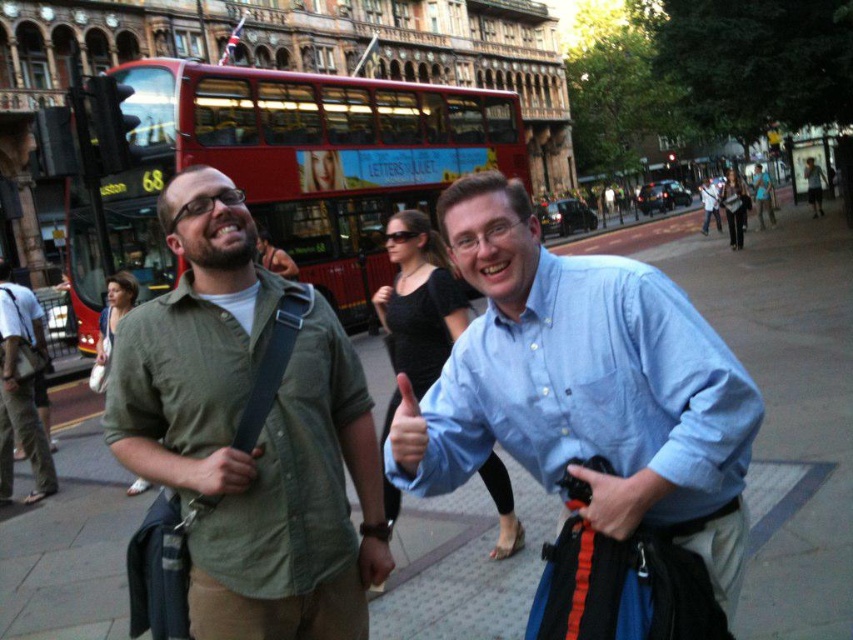
Question: From the image, what is the correct spatial relationship of light blue cotton shirt at center in relation to green cotton shirt at center?

Choices:
 (A) above
 (B) below

Answer: (B)

Question: Can you confirm if red double-decker bus at center is smaller than matte skin at center?

Choices:
 (A) no
 (B) yes

Answer: (A)

Question: Is light blue cotton shirt at center positioned in front of light blue shirt at center?

Choices:
 (A) yes
 (B) no

Answer: (A)

Question: Which of these objects is positioned closest to the matte skin at center?

Choices:
 (A) light blue cotton shirt at center
 (B) smooth skin hand at center

Answer: (B)

Question: Which point is farther from the camera taking this photo?

Choices:
 (A) (376, 531)
 (B) (247, 465)
 (C) (221, 294)

Answer: (C)

Question: Which of the following is the farthest from the observer?

Choices:
 (A) (628, 520)
 (B) (263, 289)

Answer: (B)